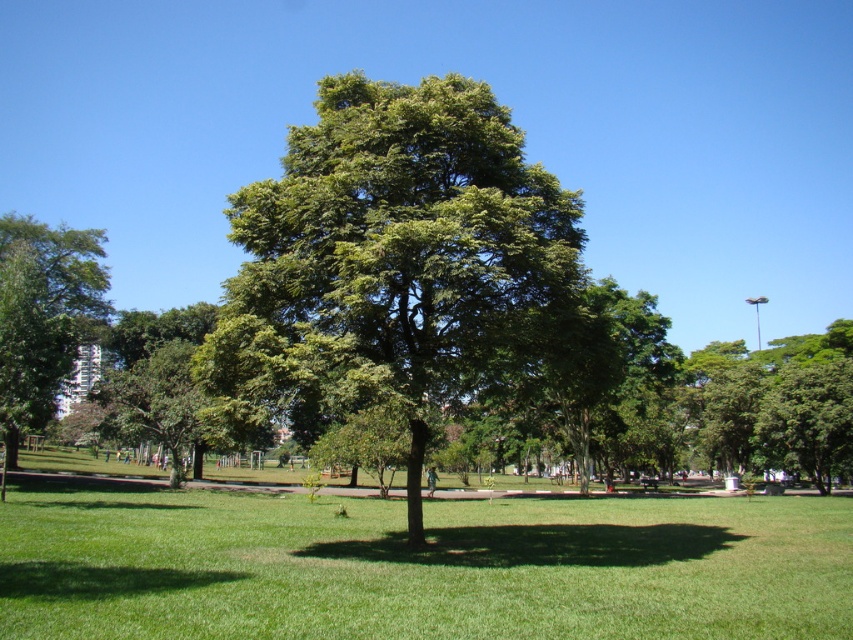
Question: Which point is closer to the camera?

Choices:
 (A) green grass at center
 (B) green leafy tree at center

Answer: (A)

Question: Where is green grass at center located in relation to green leafy tree at left in the image?

Choices:
 (A) above
 (B) below

Answer: (B)

Question: Considering the real-world distances, which object is closest to the green leafy tree at left?

Choices:
 (A) green grass at center
 (B) green leafy tree at center

Answer: (B)

Question: Is green leafy tree at center smaller than green leafy tree at left?

Choices:
 (A) no
 (B) yes

Answer: (B)

Question: Is green leafy tree at center to the right of green leafy tree at left from the viewer's perspective?

Choices:
 (A) no
 (B) yes

Answer: (B)

Question: Estimate the real-world distances between objects in this image. Which object is farther from the green leafy tree at left?

Choices:
 (A) green leafy tree at center
 (B) green grass at center

Answer: (B)